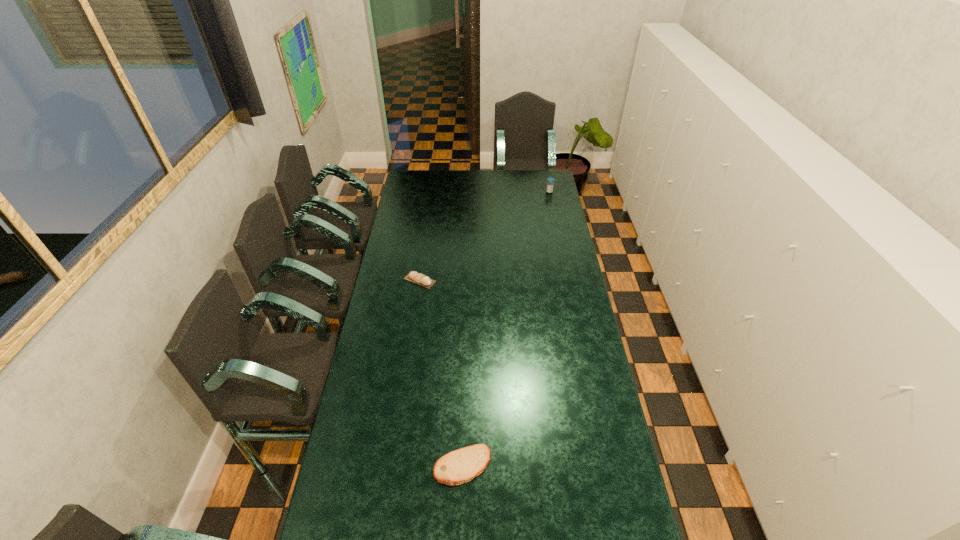
This screenshot has width=960, height=540. In order to click on object that is at the left edge in this screenshot , I will do `click(415, 277)`.

Where is `object that is at the right edge`? Image resolution: width=960 pixels, height=540 pixels. object that is at the right edge is located at coordinates point(549,189).

Locate an element on the screen. object located at the far right corner is located at coordinates (549, 189).

The height and width of the screenshot is (540, 960). I want to click on vacant space at the far edge of the desktop, so click(x=465, y=183).

Locate an element on the screen. The width and height of the screenshot is (960, 540). vacant space at the left edge is located at coordinates (390, 299).

Where is `vacant space at the right edge`? vacant space at the right edge is located at coordinates (581, 367).

The width and height of the screenshot is (960, 540). I want to click on free space at the far left corner of the desktop, so click(404, 186).

In order to click on empty space between the medicine and the right pita bread in this screenshot , I will do `click(506, 328)`.

Locate an element on the screen. vacant area that lies between the medicine and the second farthest object is located at coordinates (485, 236).

Where is `empty space that is in between the left pita bread and the farthest object`? empty space that is in between the left pita bread and the farthest object is located at coordinates (485, 236).